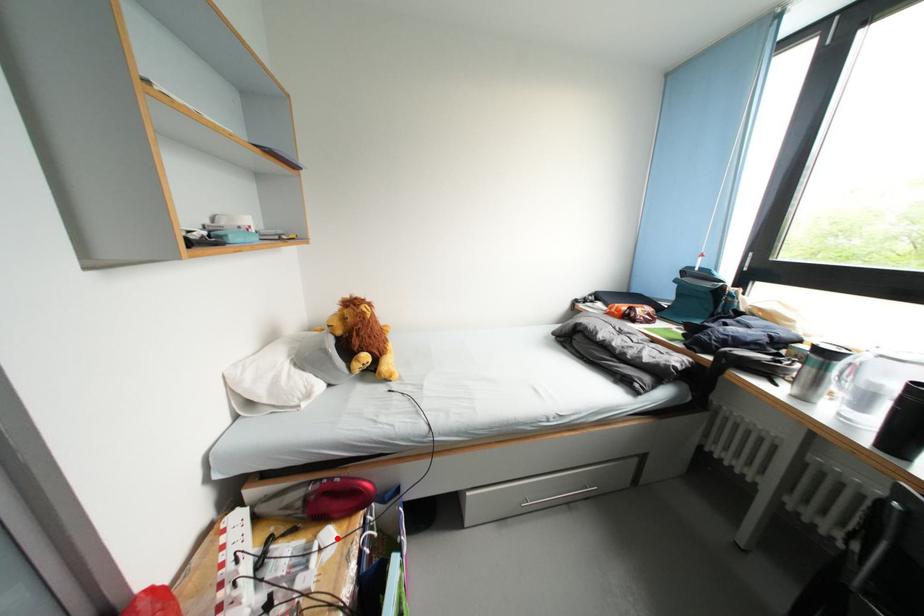
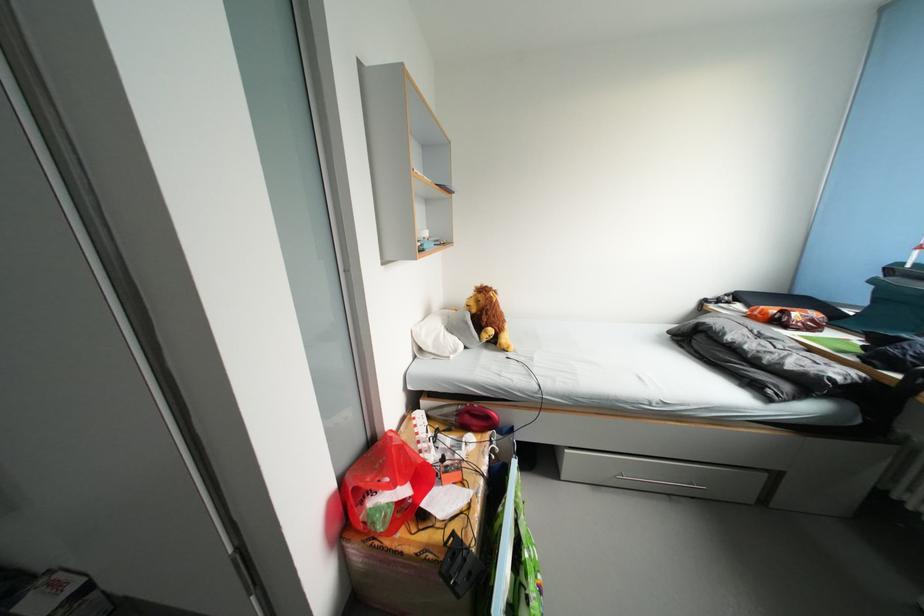
In the second image, find the point that corresponds to the highlighted location in the first image.

(479, 442)